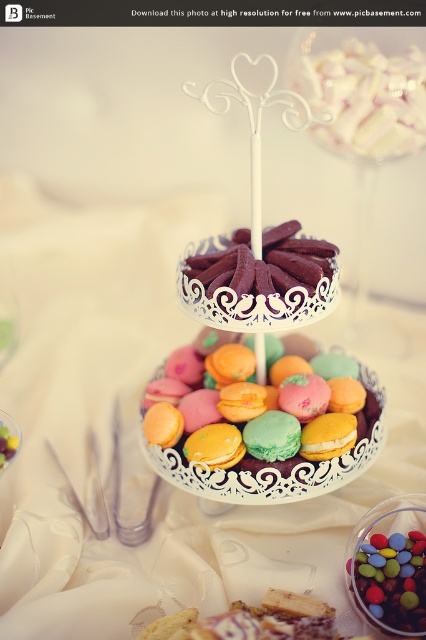
You are a guest at a wedding reception and see the two items on the dessert table. Which item is positioned to the left when looking at the white satin tablecloth at center and the pastel macarons at center?

The white satin tablecloth at center is to the left of the pastel macarons at center, so the white satin tablecloth at center is positioned to the left.

You are a guest at a wedding reception and want to take a photo of the dessert stand. You notice the white satin tablecloth at center and the multicolored coated chocolate at center. Which object will appear closer to the camera in your photo?

The white satin tablecloth at center will appear closer to the camera in your photo because it is positioned in front of the multicolored coated chocolate at center.

You are a guest at a dessert bar and want to take a photo of both the pastel macarons at center and the multicolored coated chocolate at center. To ensure both are in frame, where should you position your camera relative to the dessert stand?

Position your camera to the right side of the dessert stand so that the pastel macarons at center on the left and the multicolored coated chocolate at center on the right are both visible in the frame.